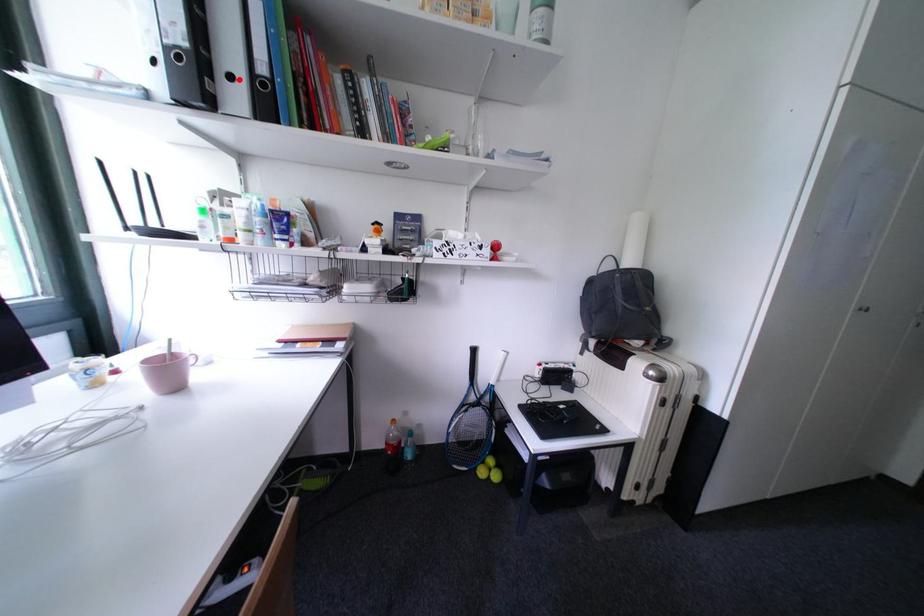
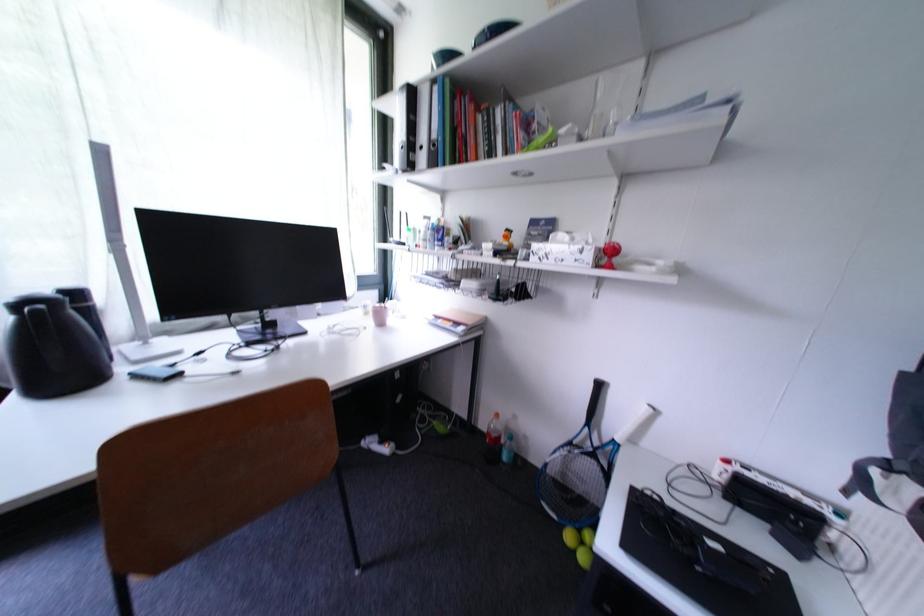
The point at the highlighted location is marked in the first image. Where is the corresponding point in the second image?

(430, 150)